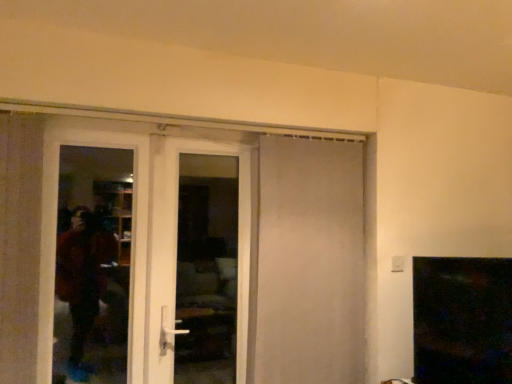
What do you see at coordinates (131, 240) in the screenshot?
I see `transparent glass screen door at left` at bounding box center [131, 240].

At what (x,y) coordinates should I click in order to perform the action: click on white glossy door at center, acting as the second door starting from the left. Please return your answer as a coordinate pair (x, y). Looking at the image, I should click on (165, 215).

Who is shorter, white glossy door at center, acting as the second door starting from the left, or white matte door at center, acting as the 1th door starting from the right?

white glossy door at center, acting as the second door starting from the left.

Which object is positioned more to the right, white glossy door at center, which is the second door in right-to-left order, or white matte door at center, which appears as the third door when viewed from the left?

white matte door at center, which appears as the third door when viewed from the left, is more to the right.

Is white glossy door at center, which is the second door in right-to-left order, not near white matte door at center, acting as the 1th door starting from the right?

white glossy door at center, which is the second door in right-to-left order, is near white matte door at center, acting as the 1th door starting from the right, not far away.

Is white matte door at center, acting as the 1th door starting from the right, positioned with its back to white glossy door at center, which is the second door in right-to-left order?

No, white matte door at center, acting as the 1th door starting from the right,'s orientation is not away from white glossy door at center, which is the second door in right-to-left order.

From a real-world perspective, is white matte door at center, acting as the 1th door starting from the right, on white glossy door at center, acting as the second door starting from the left?

Indeed, from a real-world perspective, white matte door at center, acting as the 1th door starting from the right, stands above white glossy door at center, acting as the second door starting from the left.

Is white matte door at center, which appears as the third door when viewed from the left, further to the viewer compared to white glossy door at center, acting as the second door starting from the left?

Yes, white matte door at center, which appears as the third door when viewed from the left, is behind white glossy door at center, acting as the second door starting from the left.

Is white matte door at center, which appears as the third door when viewed from the left, to the left of white glossy door at center, acting as the second door starting from the left, from the viewer's perspective?

In fact, white matte door at center, which appears as the third door when viewed from the left, is to the right of white glossy door at center, acting as the second door starting from the left.

Can we say transparent glass screen door at left lies outside white glossy door at center, acting as the second door starting from the left?

Yes, transparent glass screen door at left is not within white glossy door at center, acting as the second door starting from the left.

Image resolution: width=512 pixels, height=384 pixels. I want to click on the 1st door behind the transparent glass screen door at left, starting your count from the anchor, so click(x=165, y=215).

In the scene shown: Does transparent glass screen door at left lie in front of white glossy door at center, acting as the second door starting from the left?

Yes, transparent glass screen door at left is closer to the camera.

Consider the image. How many degrees apart are the facing directions of transparent glass screen door at left and white glossy door at center, acting as the second door starting from the left?

0.00532 degrees.

From a real-world perspective, which object rests below the other?

white matte door at center, acting as the 1th door starting from the right, from a real-world perspective.

Considering the positions of points (312, 291) and (44, 225), is point (312, 291) farther from camera compared to point (44, 225)?

Yes.

Can transparent glass screen door at left be found inside white matte door at center, acting as the 1th door starting from the right?

That's incorrect, transparent glass screen door at left is not inside white matte door at center, acting as the 1th door starting from the right.

From a real-world perspective, between white glossy door at left, placed as the first door when sorted from left to right, and white glossy door at center, acting as the second door starting from the left, who is vertically higher?

white glossy door at center, acting as the second door starting from the left, from a real-world perspective.

This screenshot has height=384, width=512. Find the location of `door on the left of white glossy door at center, which is the second door in right-to-left order`. door on the left of white glossy door at center, which is the second door in right-to-left order is located at coordinates (212, 255).

Between white glossy door at left, placed as the first door when sorted from left to right, and white glossy door at center, acting as the second door starting from the left, which one has larger width?

white glossy door at center, acting as the second door starting from the left, is wider.

Is white glossy door at left, placed as the first door when sorted from left to right, shorter than white glossy door at center, acting as the second door starting from the left?

Yes.

Where is `the 2nd door to the right of the white glossy door at left, marked as the 3th door in a right-to-left arrangement, counting from the anchor's position`? This screenshot has height=384, width=512. the 2nd door to the right of the white glossy door at left, marked as the 3th door in a right-to-left arrangement, counting from the anchor's position is located at coordinates (310, 262).

Is point (349, 335) in front of point (163, 262)?

That is False.

Can you confirm if white matte door at center, which appears as the third door when viewed from the left, is smaller than white glossy door at left, placed as the first door when sorted from left to right?

No, white matte door at center, which appears as the third door when viewed from the left, is not smaller than white glossy door at left, placed as the first door when sorted from left to right.

From their relative heights in the image, would you say white matte door at center, acting as the 1th door starting from the right, is taller or shorter than white glossy door at left, placed as the first door when sorted from left to right?

white matte door at center, acting as the 1th door starting from the right, is taller than white glossy door at left, placed as the first door when sorted from left to right.

Does transparent glass screen door at left have a greater height compared to white matte door at center, acting as the 1th door starting from the right?

No.

Which door is the 2nd one when counting from the back of the transparent glass screen door at left? Please provide its 2D coordinates.

[(310, 262)]

From the picture: Is transparent glass screen door at left beside white matte door at center, which appears as the third door when viewed from the left?

No.

From the image's perspective, which is below, transparent glass screen door at left or white matte door at center, which appears as the third door when viewed from the left?

white matte door at center, which appears as the third door when viewed from the left.

Identify the location of the 1st door in front of the white matte door at center, which appears as the third door when viewed from the left. This screenshot has width=512, height=384. (165, 215).

In order to click on door above the white matte door at center, acting as the 1th door starting from the right (from the image's perspective) in this screenshot , I will do `click(165, 215)`.

Estimate the real-world distances between objects in this image. Which object is closer to white glossy door at left, marked as the 3th door in a right-to-left arrangement, transparent glass screen door at left or white glossy door at center, which is the second door in right-to-left order?

Based on the image, white glossy door at center, which is the second door in right-to-left order, appears to be nearer to white glossy door at left, marked as the 3th door in a right-to-left arrangement.

Considering their positions, is white glossy door at center, which is the second door in right-to-left order, positioned closer to white glossy door at left, marked as the 3th door in a right-to-left arrangement, than transparent glass screen door at left?

white glossy door at center, which is the second door in right-to-left order, is closer to white glossy door at left, marked as the 3th door in a right-to-left arrangement.

Estimate the real-world distances between objects in this image. Which object is further from white glossy door at center, which is the second door in right-to-left order, white glossy door at left, marked as the 3th door in a right-to-left arrangement, or white matte door at center, which appears as the third door when viewed from the left?

The object further to white glossy door at center, which is the second door in right-to-left order, is white glossy door at left, marked as the 3th door in a right-to-left arrangement.

Which object lies nearer to the anchor point transparent glass screen door at left, white glossy door at left, marked as the 3th door in a right-to-left arrangement, or white glossy door at center, acting as the second door starting from the left?

Among the two, white glossy door at center, acting as the second door starting from the left, is located nearer to transparent glass screen door at left.

Looking at the image, which one is located closer to white glossy door at left, marked as the 3th door in a right-to-left arrangement, white glossy door at center, which is the second door in right-to-left order, or white matte door at center, which appears as the third door when viewed from the left?

white matte door at center, which appears as the third door when viewed from the left, is closer to white glossy door at left, marked as the 3th door in a right-to-left arrangement.

From the picture: Estimate the real-world distances between objects in this image. Which object is further from transparent glass screen door at left, white glossy door at left, marked as the 3th door in a right-to-left arrangement, or white matte door at center, which appears as the third door when viewed from the left?

Among the two, white glossy door at left, marked as the 3th door in a right-to-left arrangement, is located further to transparent glass screen door at left.

Estimate the real-world distances between objects in this image. Which object is further from white glossy door at center, acting as the second door starting from the left, white glossy door at left, placed as the first door when sorted from left to right, or transparent glass screen door at left?

white glossy door at left, placed as the first door when sorted from left to right, is further to white glossy door at center, acting as the second door starting from the left.

Looking at the image, which one is located closer to white glossy door at center, acting as the second door starting from the left, white matte door at center, which appears as the third door when viewed from the left, or transparent glass screen door at left?

transparent glass screen door at left lies closer to white glossy door at center, acting as the second door starting from the left, than the other object.

Identify the location of door between white glossy door at left, marked as the 3th door in a right-to-left arrangement, and white matte door at center, acting as the 1th door starting from the right. (165, 215).

Where is `door between transparent glass screen door at left and white glossy door at center, acting as the second door starting from the left, in the horizontal direction`? This screenshot has width=512, height=384. door between transparent glass screen door at left and white glossy door at center, acting as the second door starting from the left, in the horizontal direction is located at coordinates (212, 255).